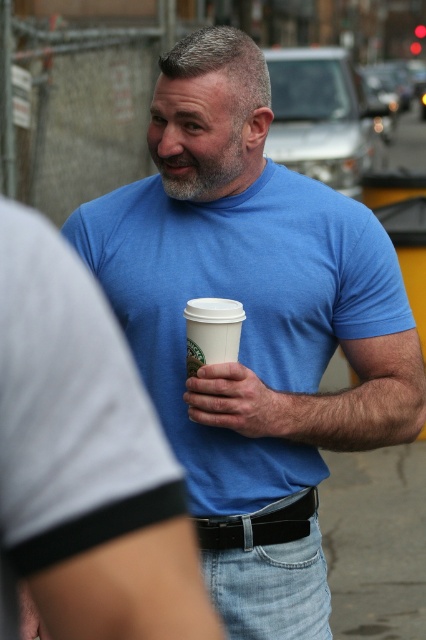
You are a barista who needs to place the white paper cup at center into the smooth skin hand at center. Based on their sizes, will the cup fit comfortably in the hand?

The smooth skin hand at center is larger in size than the white paper cup at center, so the cup will fit comfortably in the hand.

In the scene, there is a man wearing jeans at center and has a gray matte beard at center. From the perspective of an observer facing the man, which item is positioned to the right?

The jeans at center are to the right of the gray matte beard at center.